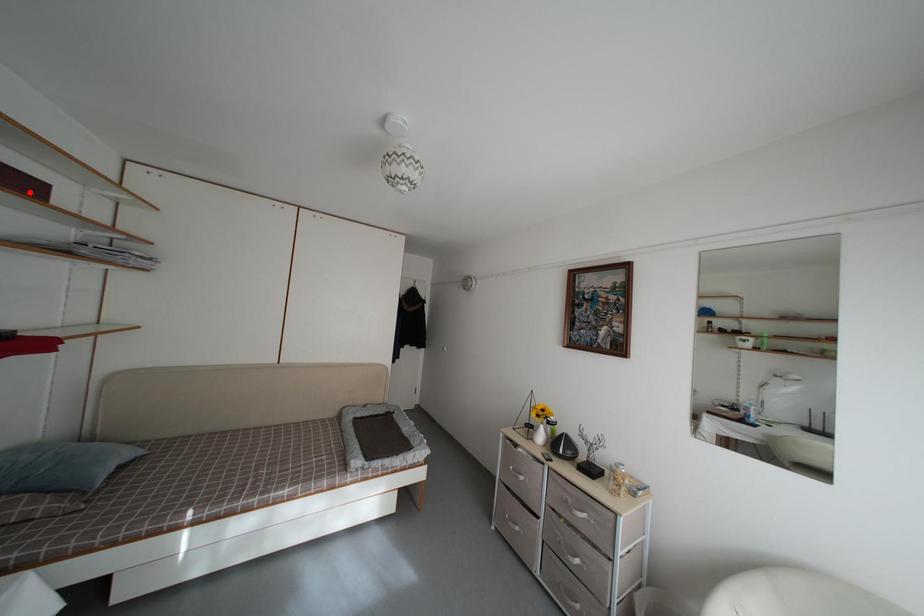
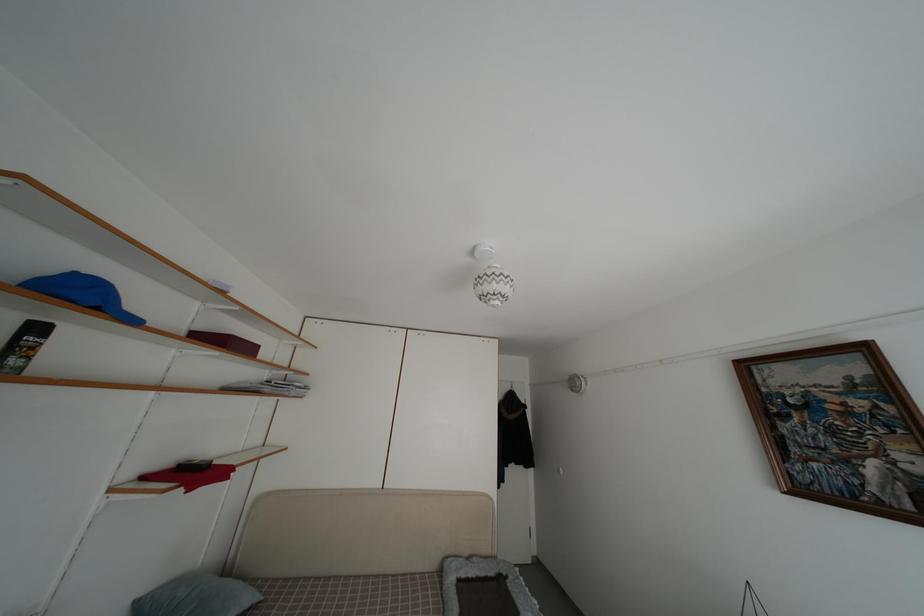
Find the pixel in the second image that matches the highlighted location in the first image.

(253, 355)